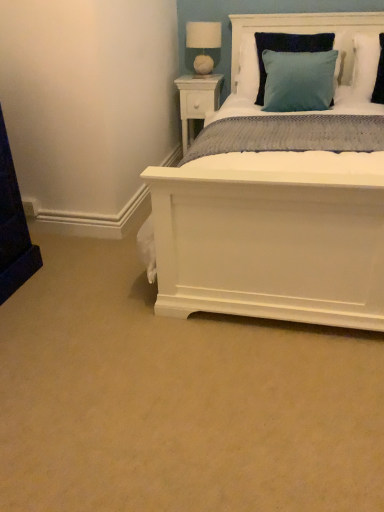
Question: In terms of size, does teal fabric pillow at upper right, positioned as the first pillow in right-to-left order, appear bigger or smaller than white wood headboard at upper center?

Choices:
 (A) big
 (B) small

Answer: (B)

Question: Looking at their shapes, would you say teal fabric pillow at upper right, positioned as the first pillow in right-to-left order, is wider or thinner than white wood headboard at upper center?

Choices:
 (A) thin
 (B) wide

Answer: (A)

Question: Based on their relative distances, which object is nearer to the white fabric-covered lampshade at upper center?

Choices:
 (A) teal fabric pillow at upper right, positioned as the first pillow in right-to-left order
 (B) white wood nightstand at upper center
 (C) teal velvet pillow at upper right, placed as the second pillow when sorted from right to left
 (D) white wood headboard at upper center

Answer: (B)

Question: Which of these objects is positioned farthest from the white fabric-covered lampshade at upper center?

Choices:
 (A) teal fabric pillow at upper right, placed as the 2th pillow when sorted from left to right
 (B) teal velvet pillow at upper right, placed as the second pillow when sorted from right to left
 (C) white wood nightstand at upper center
 (D) white wood headboard at upper center

Answer: (A)